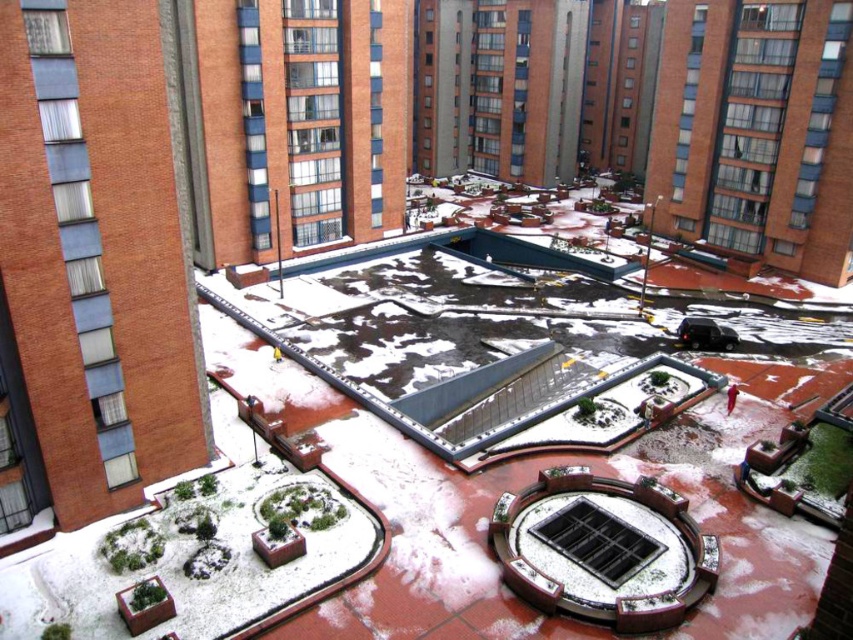
Question: Which of the following is the closest to the observer?

Choices:
 (A) pos(189,67)
 (B) pos(809,244)

Answer: (A)

Question: Considering the relative positions of brick building at center and brick building at upper right in the image provided, where is brick building at center located with respect to brick building at upper right?

Choices:
 (A) right
 (B) left

Answer: (B)

Question: Which of the following is the farthest from the observer?

Choices:
 (A) brick building at upper right
 (B) brick building at center

Answer: (A)

Question: Can you confirm if brick building at center is smaller than brick building at upper right?

Choices:
 (A) yes
 (B) no

Answer: (B)

Question: Where is brick building at center located in relation to brick building at upper right in the image?

Choices:
 (A) right
 (B) left

Answer: (B)